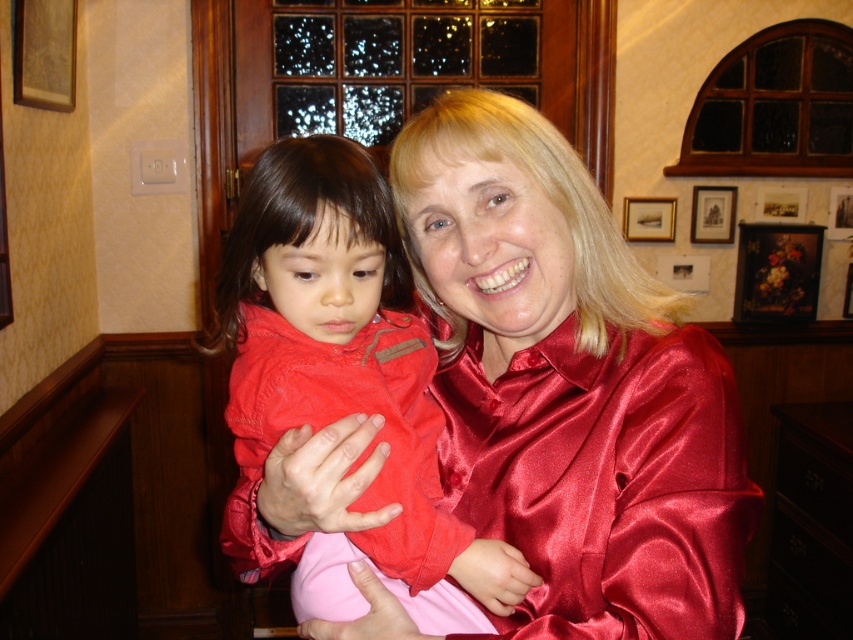
Question: Observing the image, what is the correct spatial positioning of satin red blouse at center in reference to matte red jacket at center?

Choices:
 (A) below
 (B) above

Answer: (B)

Question: Which point is closer to the camera?

Choices:
 (A) satin red blouse at center
 (B) matte red jacket at center

Answer: (A)

Question: Is satin red blouse at center bigger than matte red jacket at center?

Choices:
 (A) yes
 (B) no

Answer: (A)

Question: Is satin red blouse at center smaller than matte red jacket at center?

Choices:
 (A) no
 (B) yes

Answer: (A)